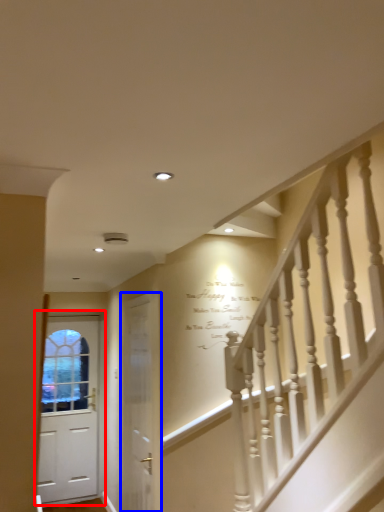
Question: Which object is closer to the camera taking this photo, door (highlighted by a red box) or door (highlighted by a blue box)?

Choices:
 (A) door
 (B) door

Answer: (B)